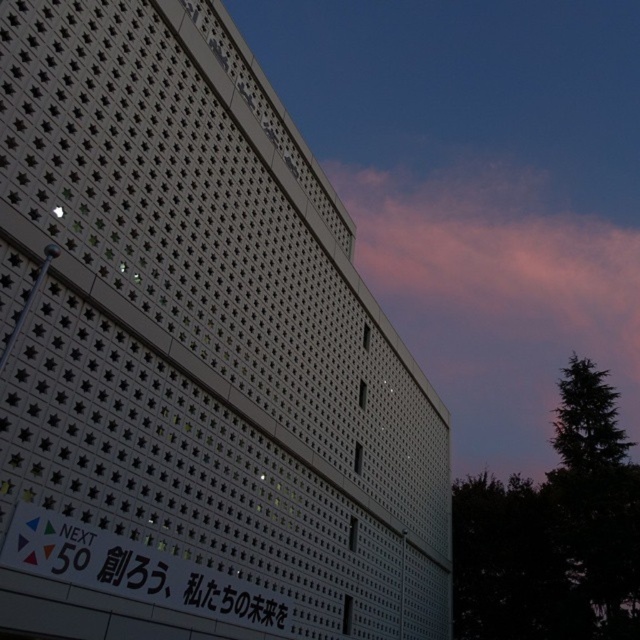
Question: Which point appears farthest from the camera in this image?

Choices:
 (A) (38, 518)
 (B) (561, 566)

Answer: (B)

Question: Where is dark green leafy tree at upper right located in relation to white glossy sign at lower left in the image?

Choices:
 (A) below
 (B) above

Answer: (A)

Question: Is pink cotton cloud at upper center wider than white glossy sign at lower left?

Choices:
 (A) no
 (B) yes

Answer: (B)

Question: Which point appears farthest from the camera in this image?

Choices:
 (A) (228, 582)
 (B) (612, 440)

Answer: (B)

Question: Based on their relative distances, which object is nearer to the dark green leafy tree at upper right?

Choices:
 (A) pink cotton cloud at upper center
 (B) white glossy sign at lower left

Answer: (B)

Question: Can you confirm if dark green leafy tree at upper right is bigger than white glossy sign at lower left?

Choices:
 (A) no
 (B) yes

Answer: (B)